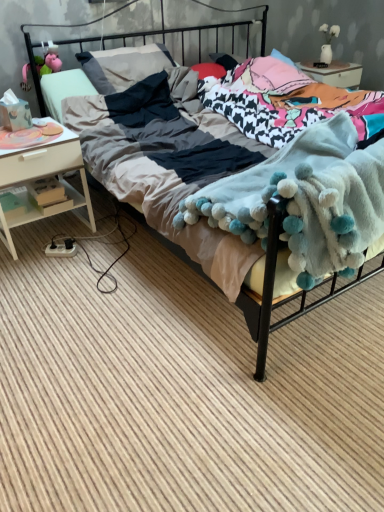
Find the location of a particular element. The height and width of the screenshot is (512, 384). vacant area located to the right-hand side of white wood nightstand at left is located at coordinates (110, 240).